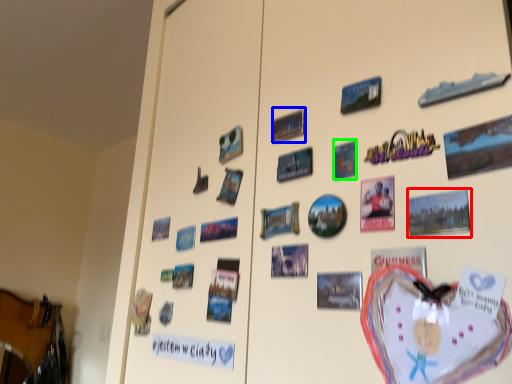
Question: Based on their relative distances, which object is farther from postcard (highlighted by a red box)? Choose from poster (highlighted by a blue box) and postcard (highlighted by a green box).

Choices:
 (A) poster
 (B) postcard

Answer: (A)